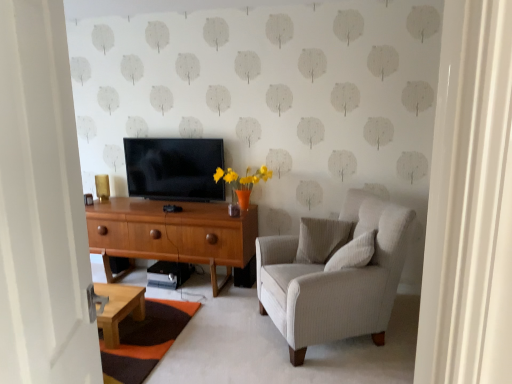
Question: Visually, is white textured pillow at center, which ranks as the second pillow in back-to-front order, positioned to the left or to the right of white wooden door at left?

Choices:
 (A) left
 (B) right

Answer: (B)

Question: Is white textured pillow at center, the 1th pillow in the front-to-back sequence, wider or thinner than white wooden door at left?

Choices:
 (A) wide
 (B) thin

Answer: (A)

Question: Estimate the real-world distances between objects in this image. Which object is closer to the woodendesk at center?

Choices:
 (A) white wooden door at left
 (B) white textured pillow at center, acting as the 2th pillow starting from the front
 (C) white textured pillow at center, the 1th pillow in the front-to-back sequence
 (D) flat screen tv at center
 (E) light gray fabric armchair at right

Answer: (D)

Question: Based on their relative distances, which object is farther from the woodendesk at center?

Choices:
 (A) white wooden door at left
 (B) white textured pillow at center, arranged as the 1th pillow when viewed from the back
 (C) light gray fabric armchair at right
 (D) white textured pillow at center, which ranks as the second pillow in back-to-front order
 (E) flat screen tv at center

Answer: (A)